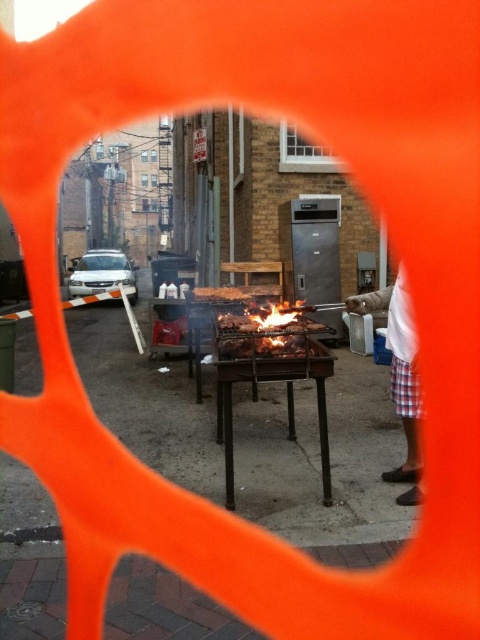
Image resolution: width=480 pixels, height=640 pixels. I want to click on flaming wood at center, so click(275, 326).

Who is positioned more to the left, flaming wood at center or charcoal grill at center?

Positioned to the left is charcoal grill at center.

The width and height of the screenshot is (480, 640). What are the coordinates of `flaming wood at center` in the screenshot? It's located at (275, 326).

Between point (230, 356) and point (247, 294), which one is positioned in front?

Point (230, 356)

Does point (240, 330) come farther from viewer compared to point (224, 298)?

No, (240, 330) is closer to viewer.

What are the coordinates of `charcoal black grill at center` in the screenshot? It's located at (264, 332).

Does white plaid shorts at right have a lesser height compared to charcoal black grill at center?

No, white plaid shorts at right is not shorter than charcoal black grill at center.

At what (x,y) coordinates should I click in order to perform the action: click on white plaid shorts at right. Please return your answer as a coordinate pair (x, y). Looking at the image, I should click on click(404, 387).

The image size is (480, 640). In order to click on white plaid shorts at right in this screenshot , I will do `click(404, 387)`.